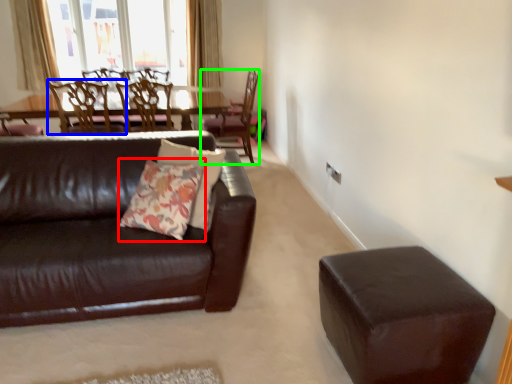
Question: Based on their relative distances, which object is farther from throw pillow (highlighted by a red box)? Choose from chair (highlighted by a blue box) and chair (highlighted by a green box).

Choices:
 (A) chair
 (B) chair

Answer: (B)